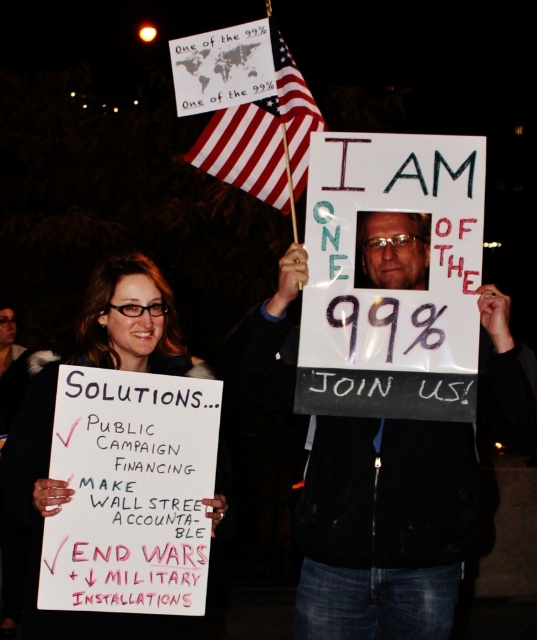
Question: Which object appears closest to the camera in this image?

Choices:
 (A) matte white sign at center
 (B) white paper sign at center
 (C) american flag at upper center

Answer: (A)

Question: In this image, where is white paper sign at center located relative to american flag at upper center?

Choices:
 (A) below
 (B) above

Answer: (A)

Question: Among these objects, which one is nearest to the camera?

Choices:
 (A) white paper sign at center
 (B) matte white sign at center
 (C) clear plastic glasses at upper center

Answer: (B)

Question: Based on their relative distances, which object is nearer to the american flag at upper center?

Choices:
 (A) white paper sign at center
 (B) clear plastic glasses at upper center

Answer: (B)

Question: Is white paper sign at center thinner than clear plastic glasses at upper center?

Choices:
 (A) no
 (B) yes

Answer: (A)

Question: Can you confirm if matte white sign at center is positioned below american flag at upper center?

Choices:
 (A) yes
 (B) no

Answer: (A)